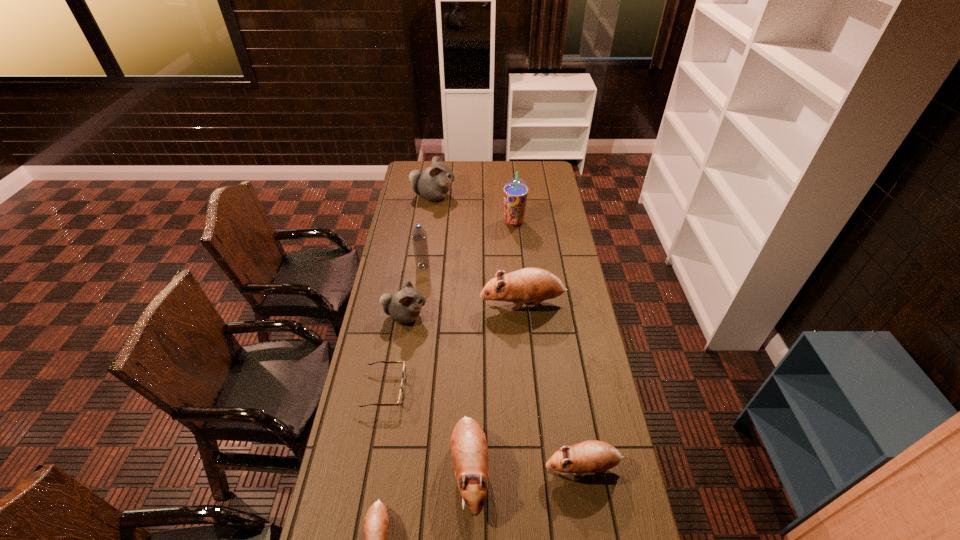
Identify the location of free location located at the face of the second shortest hamster. The width and height of the screenshot is (960, 540). (488, 467).

At what (x,y) coordinates should I click in order to perform the action: click on free space located at the face of the second shortest hamster. Please return your answer as a coordinate pair (x, y). This screenshot has height=540, width=960. Looking at the image, I should click on (517, 467).

At what (x,y) coordinates should I click in order to perform the action: click on free space located 0.060m at the face of the second shortest hamster. Please return your answer as a coordinate pair (x, y). The image size is (960, 540). Looking at the image, I should click on (524, 467).

Locate an element on the screen. This screenshot has height=540, width=960. vacant space located on the frame of the shortest object is located at coordinates (479, 390).

Identify the location of water bottle located at the left edge. (419, 237).

You are a GUI agent. You are given a task and a screenshot of the screen. Output one action in this format:
    pyautogui.click(x=<x>, y=<y>)
    Task: Click on the spectacles at the left edge
    This screenshot has width=960, height=540.
    Given the screenshot: What is the action you would take?
    pyautogui.click(x=400, y=400)

Locate an element on the screen. The height and width of the screenshot is (540, 960). free space at the far edge of the desktop is located at coordinates (469, 171).

Image resolution: width=960 pixels, height=540 pixels. In the image, there is a desktop. In order to click on blank space at the left edge in this screenshot , I will do `click(359, 413)`.

Where is `free space at the right edge`? This screenshot has height=540, width=960. free space at the right edge is located at coordinates (612, 431).

In the image, there is a desktop. Identify the location of vacant space at the far left corner. (409, 171).